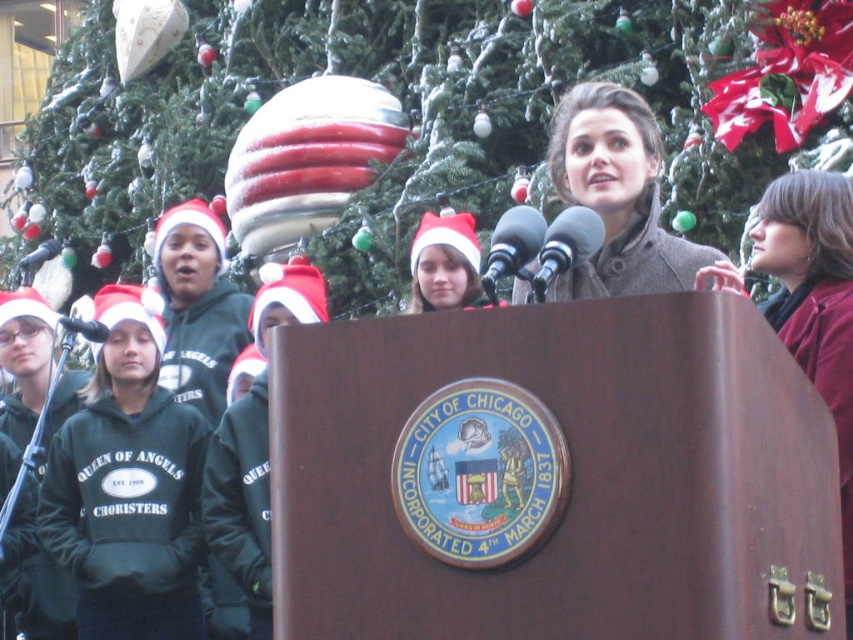
You are a photographer standing at the podium in the scene. You want to take a photo of the green textured christmas tree at upper center. Based on its 2D location coordinates, where should you position your camera to capture it in the frame?

The green textured christmas tree at upper center is located at coordinates point (399, 113), so you should position your camera to aim towards the upper center area of the scene to capture it in the frame.

You are a stagehand setting up for a holiday performance. You need to place two microphones so they are exactly 2 meters apart. The metallic gray microphone at center and the black matte microphone at center are currently 2.22 meters apart. Can you adjust them to meet the requirement?

The metallic gray microphone at center and the black matte microphone at center are currently 2.22 meters apart. To meet the 2 meters requirement, you need to move them closer by 0.22 meters.

Looking at this image, you are a stage manager preparing for a performance. You have two microphones on stage, the metallic gray microphone at center and the black matte microphone at center. Which microphone is shorter?

The metallic gray microphone at center is not as tall as the black matte microphone at center, so the metallic gray microphone at center is shorter.